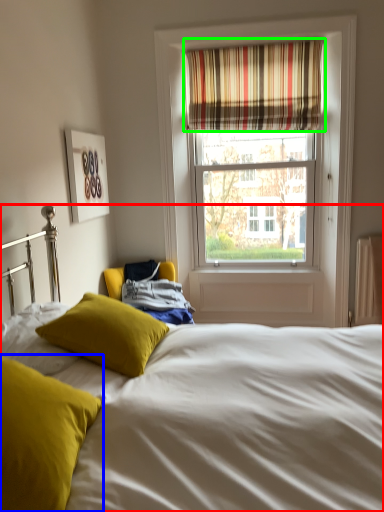
Question: Considering the real-world distances, which object is closest to bed (highlighted by a red box)? pillow (highlighted by a blue box) or curtain (highlighted by a green box).

Choices:
 (A) pillow
 (B) curtain

Answer: (A)